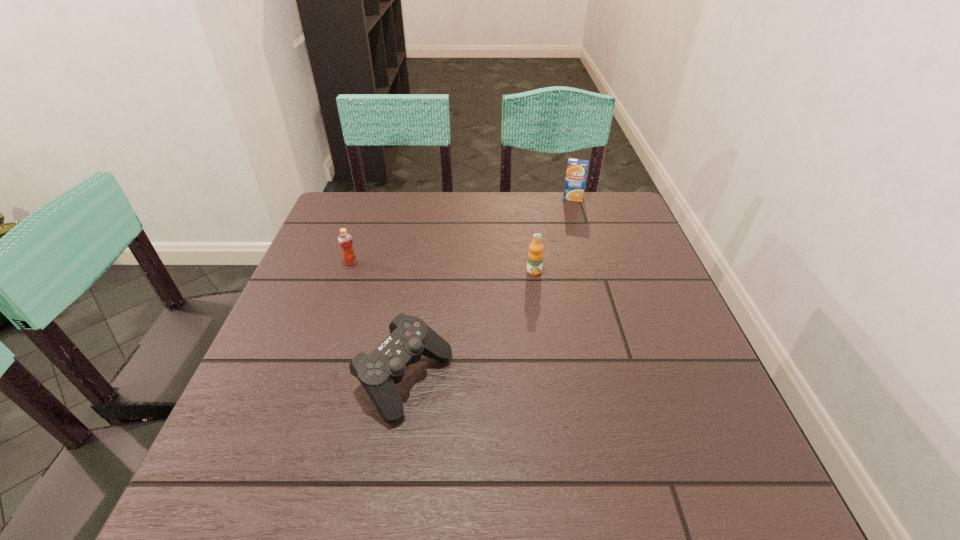
Where is `the rightmost object`? The image size is (960, 540). the rightmost object is located at coordinates (577, 169).

Image resolution: width=960 pixels, height=540 pixels. Find the location of `the rightmost orange juice`. the rightmost orange juice is located at coordinates (577, 169).

The image size is (960, 540). Identify the location of the second orange juice from right to left. (535, 255).

What are the coordinates of `the third object from left to right` in the screenshot? It's located at (535, 255).

This screenshot has width=960, height=540. I want to click on the second nearest orange juice, so click(x=345, y=240).

Where is `the leftmost orange juice`? Image resolution: width=960 pixels, height=540 pixels. the leftmost orange juice is located at coordinates (345, 240).

The width and height of the screenshot is (960, 540). Identify the location of the third object from right to left. (410, 337).

I want to click on the nearest object, so click(410, 337).

Identify the location of free space located on the front of the farthest orange juice. This screenshot has height=540, width=960. (599, 285).

Identify the location of vacant space located 0.050m on the label of the second orange juice from right to left. Image resolution: width=960 pixels, height=540 pixels. (537, 291).